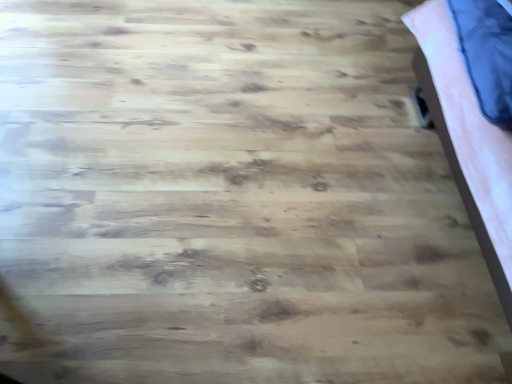
What is the approximate width of velvety blue pillow at upper right?

33.24 centimeters.

The height and width of the screenshot is (384, 512). Find the location of `velvety blue pillow at upper right`. velvety blue pillow at upper right is located at coordinates (487, 55).

The image size is (512, 384). What do you see at coordinates (487, 55) in the screenshot?
I see `velvety blue pillow at upper right` at bounding box center [487, 55].

What is the approximate height of pink fabric bed at right?

27.95 inches.

Measure the distance between point (500, 173) and camera.

A distance of 3.94 feet exists between point (500, 173) and camera.

The image size is (512, 384). Describe the element at coordinates (467, 140) in the screenshot. I see `pink fabric bed at right` at that location.

At what (x,y) coordinates should I click in order to perform the action: click on pink fabric bed at right. Please return your answer as a coordinate pair (x, y). The height and width of the screenshot is (384, 512). Looking at the image, I should click on (467, 140).

What is the approximate width of pink fabric bed at right?

25.53 inches.

Find the location of `velvety blue pillow at upper right`. velvety blue pillow at upper right is located at coordinates (487, 55).

Between pink fabric bed at right and velvety blue pillow at upper right, which one appears on the right side from the viewer's perspective?

From the viewer's perspective, pink fabric bed at right appears more on the right side.

From the picture: Is the depth of pink fabric bed at right greater than that of velvety blue pillow at upper right?

No, pink fabric bed at right is closer to the camera.

Which is nearer, (443, 74) or (509, 68)?

Point (509, 68)

From the image's perspective, is pink fabric bed at right on top of velvety blue pillow at upper right?

No, from the image's perspective, pink fabric bed at right is not on top of velvety blue pillow at upper right.

From a real-world perspective, between pink fabric bed at right and velvety blue pillow at upper right, who is vertically higher?

velvety blue pillow at upper right, from a real-world perspective.

Which of these two, pink fabric bed at right or velvety blue pillow at upper right, is wider?

pink fabric bed at right is wider.

Consider the image. Considering the sizes of objects pink fabric bed at right and velvety blue pillow at upper right in the image provided, who is shorter, pink fabric bed at right or velvety blue pillow at upper right?

velvety blue pillow at upper right.

Can you confirm if pink fabric bed at right is bigger than velvety blue pillow at upper right?

Indeed, pink fabric bed at right has a larger size compared to velvety blue pillow at upper right.

Which is correct: pink fabric bed at right is inside velvety blue pillow at upper right, or outside of it?

pink fabric bed at right is located beyond the bounds of velvety blue pillow at upper right.

Are pink fabric bed at right and velvety blue pillow at upper right far apart?

They are positioned close to each other.

Is pink fabric bed at right positioned with its back to velvety blue pillow at upper right?

Yes, velvety blue pillow at upper right is at the back of pink fabric bed at right.

How many degrees apart are the facing directions of pink fabric bed at right and velvety blue pillow at upper right?

2.85 degrees.

This screenshot has width=512, height=384. Find the location of `pillow above the pink fabric bed at right (from a real-world perspective)`. pillow above the pink fabric bed at right (from a real-world perspective) is located at coordinates (487, 55).

Would you say velvety blue pillow at upper right is to the left or to the right of pink fabric bed at right in the picture?

velvety blue pillow at upper right is to the left of pink fabric bed at right.

Considering the positions of objects velvety blue pillow at upper right and pink fabric bed at right in the image provided, who is behind, velvety blue pillow at upper right or pink fabric bed at right?

velvety blue pillow at upper right is more distant.

Which point is more distant from viewer, (468, 57) or (487, 241)?

The point (487, 241) is farther from the camera.

From the image's perspective, is velvety blue pillow at upper right beneath pink fabric bed at right?

No.

From a real-world perspective, between velvety blue pillow at upper right and pink fabric bed at right, who is vertically lower?

From a 3D spatial view, pink fabric bed at right is below.

Considering the sizes of objects velvety blue pillow at upper right and pink fabric bed at right in the image provided, who is wider, velvety blue pillow at upper right or pink fabric bed at right?

With larger width is pink fabric bed at right.

Between velvety blue pillow at upper right and pink fabric bed at right, which one has more height?

pink fabric bed at right.

Who is bigger, velvety blue pillow at upper right or pink fabric bed at right?

pink fabric bed at right is bigger.

Is velvety blue pillow at upper right surrounding pink fabric bed at right?

No, pink fabric bed at right is not inside velvety blue pillow at upper right.

From the picture: Are velvety blue pillow at upper right and pink fabric bed at right making contact?

No, velvety blue pillow at upper right is not making contact with pink fabric bed at right.

Consider the image. Could you tell me if velvety blue pillow at upper right is turned towards pink fabric bed at right?

Yes.

Identify the location of pillow above the pink fabric bed at right (from a real-world perspective). (487, 55).

At what (x,y) coordinates should I click in order to perform the action: click on bed located underneath the velvety blue pillow at upper right (from a real-world perspective). Please return your answer as a coordinate pair (x, y). Looking at the image, I should click on click(x=467, y=140).

This screenshot has width=512, height=384. I want to click on bed that is on the right side of velvety blue pillow at upper right, so click(x=467, y=140).